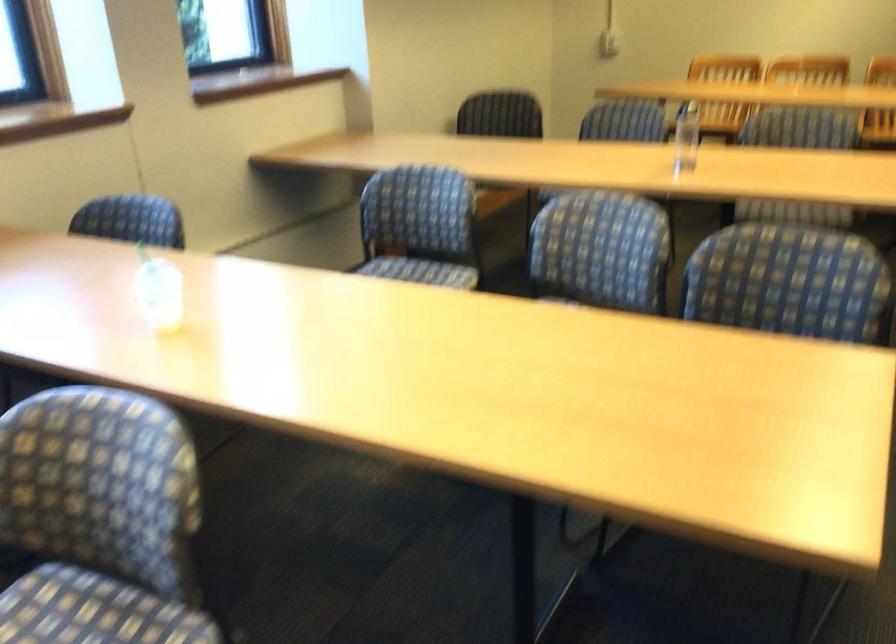
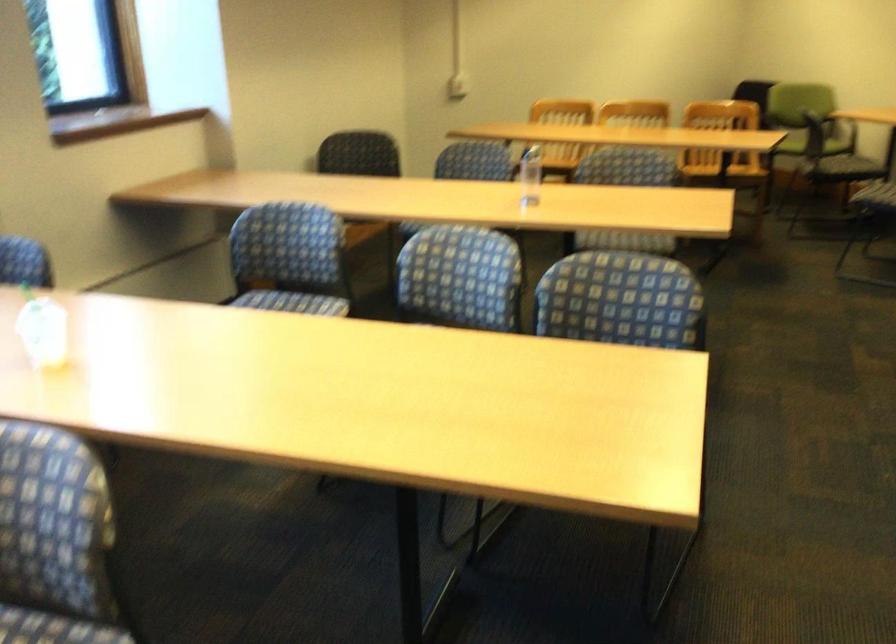
The point at [144,521] is marked in the first image. Where is the corresponding point in the second image?

(54, 540)